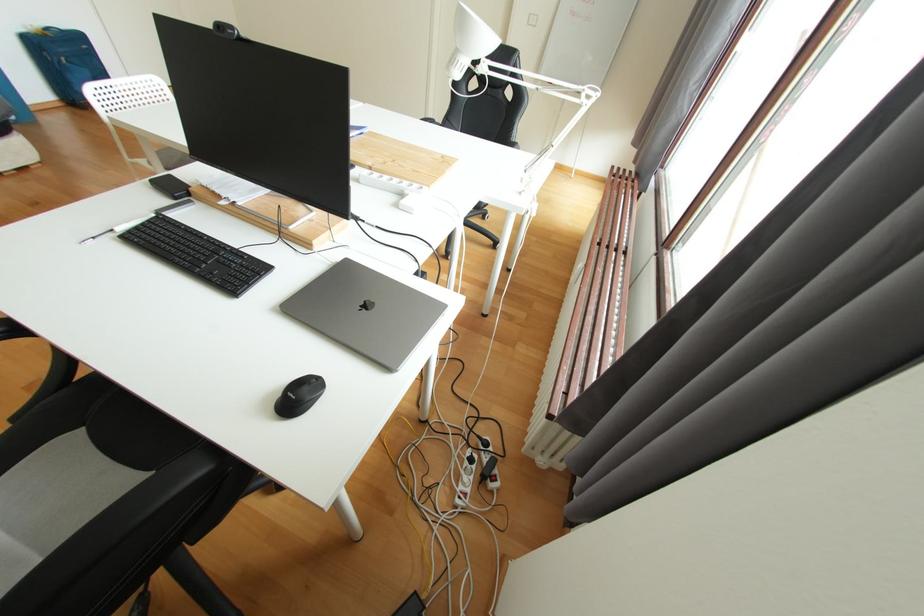
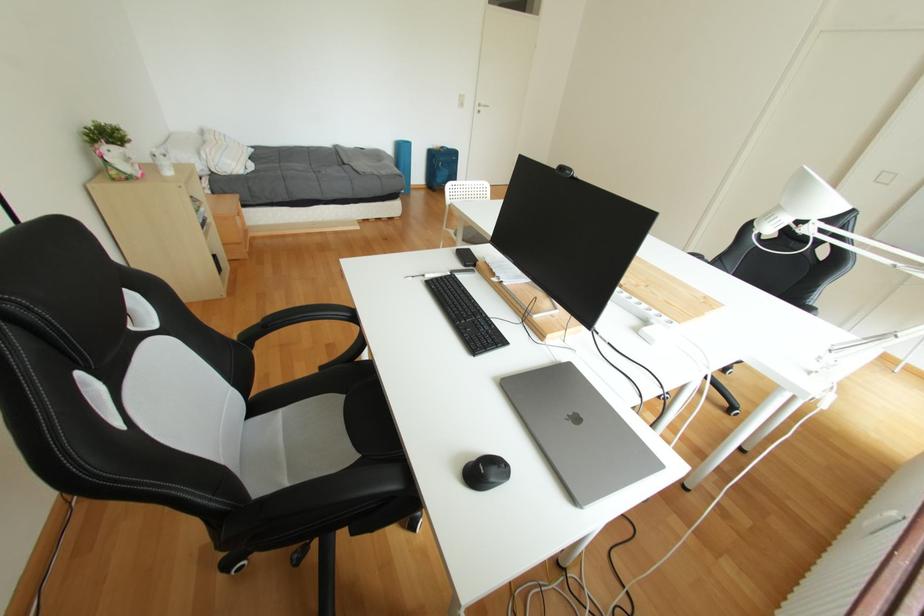
Question: The camera is either moving clockwise (left) or counter-clockwise (right) around the object. The first image is from the beginning of the video and the second image is from the end. Is the camera moving left or right when shooting the video?

Choices:
 (A) Left
 (B) Right

Answer: (B)